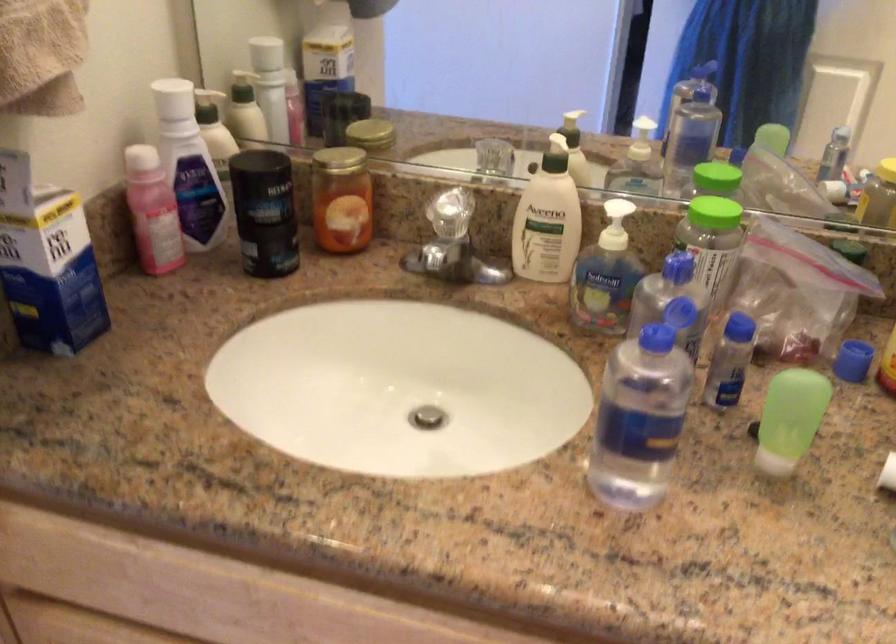
In order to click on faucet handle in this screenshot , I will do `click(428, 261)`.